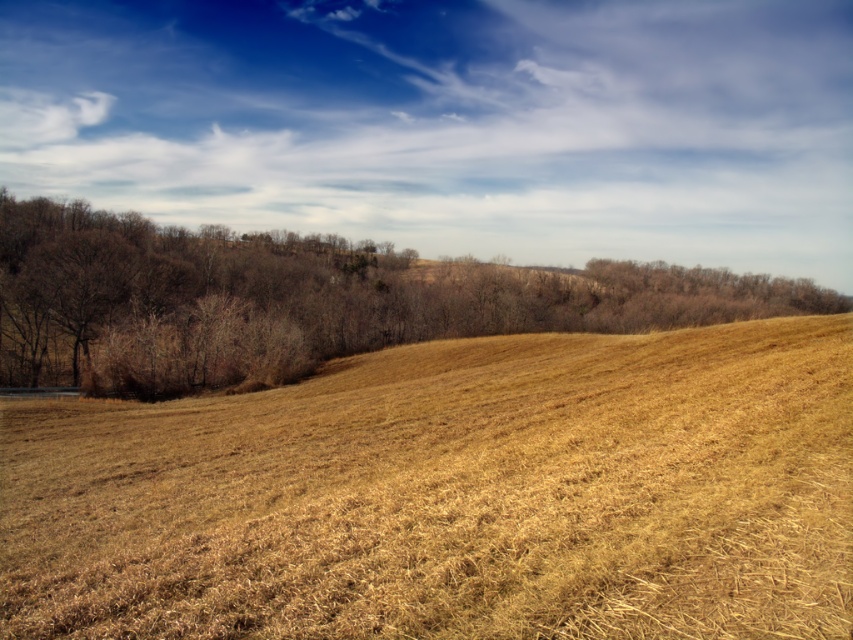
Describe the element at coordinates (451, 496) in the screenshot. Image resolution: width=853 pixels, height=640 pixels. I see `dry straw at center` at that location.

Is dry straw at center in front of brown leafless tree at center?

Yes, it is in front of brown leafless tree at center.

Image resolution: width=853 pixels, height=640 pixels. Identify the location of dry straw at center. point(451,496).

Where is `dry straw at center`? dry straw at center is located at coordinates (451, 496).